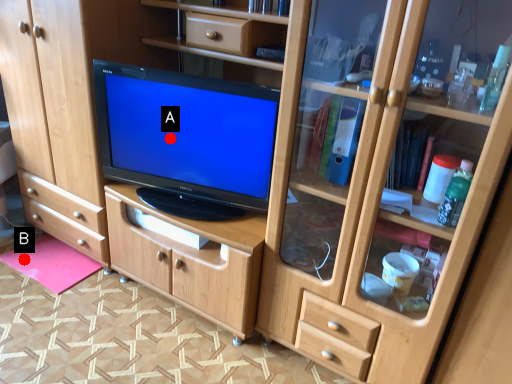
Question: Two points are circled on the image, labeled by A and B beside each circle. Which point is farther from the camera taking this photo?

Choices:
 (A) A is further
 (B) B is further

Answer: (B)